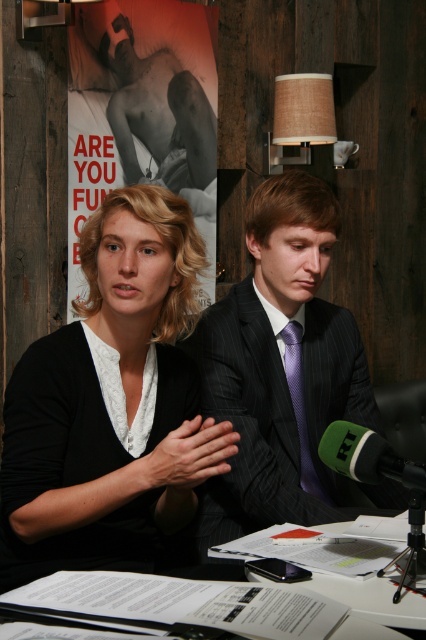
Question: Does dark gray pinstripe suit at center come in front of purple satin tie at center?

Choices:
 (A) no
 (B) yes

Answer: (B)

Question: Among these objects, which one is nearest to the camera?

Choices:
 (A) white paper at lower center
 (B) dark gray pinstripe suit at center
 (C) matte black poster at upper left
 (D) purple satin tie at center

Answer: (A)

Question: Can you confirm if black matte sweater at center is positioned below green foam microphone at lower center?

Choices:
 (A) no
 (B) yes

Answer: (A)

Question: Which object appears farthest from the camera in this image?

Choices:
 (A) dark gray pinstripe suit at center
 (B) green foam microphone at lower center
 (C) black matte sweater at center

Answer: (A)

Question: Does dark gray pinstripe suit at center have a greater width compared to white paper at lower center?

Choices:
 (A) yes
 (B) no

Answer: (B)

Question: Which point appears closest to the camera in this image?

Choices:
 (A) (222, 620)
 (B) (218, 385)

Answer: (A)